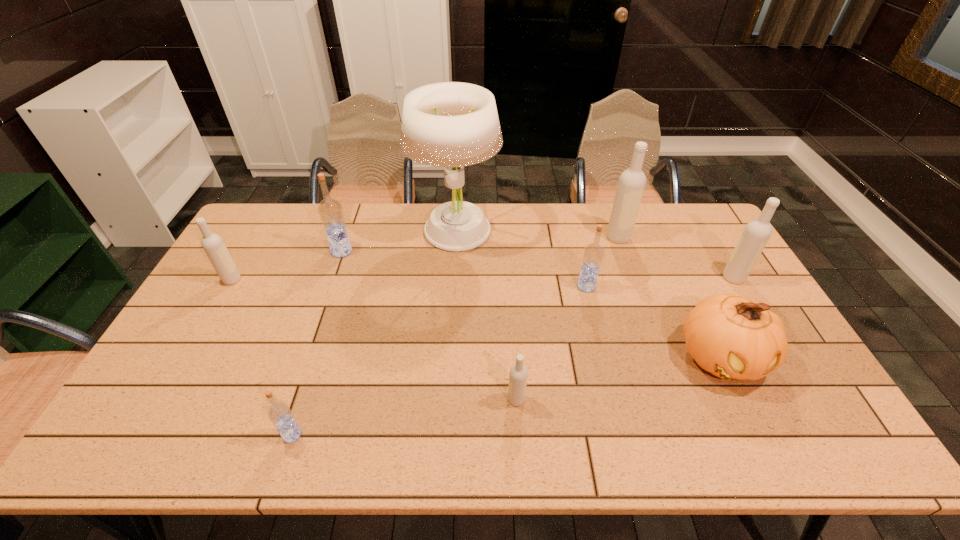
The width and height of the screenshot is (960, 540). Find the location of `white vodka that stands as the closest to the second object from right to left`. white vodka that stands as the closest to the second object from right to left is located at coordinates tap(757, 232).

Locate which blue vodka ranks in proximity to the rightmost blue vodka. Please provide its 2D coordinates. Your answer should be formatted as a tuple, i.e. [(x, y)], where the tuple contains the x and y coordinates of a point satisfying the conditions above.

[(330, 210)]

Select which blue vodka appears as the second closest to the farthest white vodka. Please provide its 2D coordinates. Your answer should be formatted as a tuple, i.e. [(x, y)], where the tuple contains the x and y coordinates of a point satisfying the conditions above.

[(330, 210)]

The width and height of the screenshot is (960, 540). What are the coordinates of `vacant position in the image that satisfies the following two spatial constraints: 1. on the front-facing side of the rightmost blue vodka; 2. on the left side of the white lamp` in the screenshot? It's located at (452, 286).